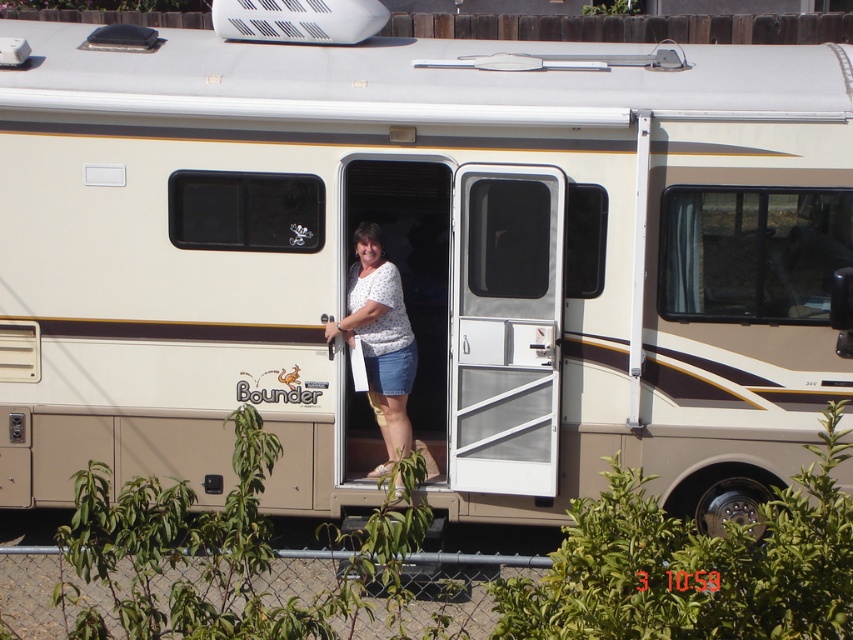
Question: Among these points, which one is farthest from the camera?

Choices:
 (A) (538, 419)
 (B) (363, 250)

Answer: (B)

Question: Can you confirm if white plastic door at center is bigger than white dotted shirt at center?

Choices:
 (A) no
 (B) yes

Answer: (A)

Question: Observing the image, what is the correct spatial positioning of white plastic door at center in reference to white dotted shirt at center?

Choices:
 (A) below
 (B) above

Answer: (B)

Question: Does white plastic door at center have a smaller size compared to white dotted shirt at center?

Choices:
 (A) no
 (B) yes

Answer: (B)

Question: Which point is closer to the camera taking this photo?

Choices:
 (A) (384, 428)
 (B) (555, 321)

Answer: (B)